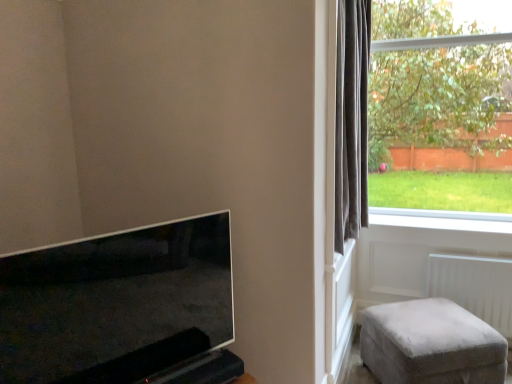
This screenshot has width=512, height=384. I want to click on transparent glass window at right, so coord(438,91).

The width and height of the screenshot is (512, 384). What do you see at coordinates (431, 344) in the screenshot?
I see `velvet grey ottoman at lower right` at bounding box center [431, 344].

What is the approximate width of velvet grey ottoman at lower right?

velvet grey ottoman at lower right is 24.10 inches wide.

Locate an element on the screen. matte black tv at lower left is located at coordinates (116, 304).

The width and height of the screenshot is (512, 384). What do you see at coordinates (116, 304) in the screenshot? I see `matte black tv at lower left` at bounding box center [116, 304].

The height and width of the screenshot is (384, 512). Identify the location of dark grey velvet curtain at right. (351, 119).

Find the location of a particular element. This screenshot has width=512, height=384. transparent glass window at right is located at coordinates tap(438, 91).

Based on the photo, looking at their sizes, would you say dark grey velvet curtain at right is wider or thinner than white smooth window sill at lower right?

In the image, dark grey velvet curtain at right appears to be more narrow than white smooth window sill at lower right.

Is dark grey velvet curtain at right bigger or smaller than white smooth window sill at lower right?

In the image, dark grey velvet curtain at right appears to be larger than white smooth window sill at lower right.

From their relative heights in the image, would you say dark grey velvet curtain at right is taller or shorter than white smooth window sill at lower right?

Clearly, dark grey velvet curtain at right is taller compared to white smooth window sill at lower right.

Is velvet grey ottoman at lower right turned away from dark grey velvet curtain at right?

velvet grey ottoman at lower right is not turned away from dark grey velvet curtain at right.

Is velvet grey ottoman at lower right taller or shorter than dark grey velvet curtain at right?

In the image, velvet grey ottoman at lower right appears to be shorter than dark grey velvet curtain at right.

How different are the orientations of velvet grey ottoman at lower right and dark grey velvet curtain at right in degrees?

The angular difference between velvet grey ottoman at lower right and dark grey velvet curtain at right is 55.4 degrees.

From a real-world perspective, is velvet grey ottoman at lower right positioned under dark grey velvet curtain at right based on gravity?

Correct, in the physical world, velvet grey ottoman at lower right is lower than dark grey velvet curtain at right.

Which is closer to the camera, (439,356) or (182,270)?

Point (182,270)

From a real-world perspective, is velvet grey ottoman at lower right positioned above or below matte black tv at lower left?

velvet grey ottoman at lower right is below matte black tv at lower left.

From the picture: Can you tell me how much velvet grey ottoman at lower right and matte black tv at lower left differ in facing direction?

There is a 27-degree angle between the facing directions of velvet grey ottoman at lower right and matte black tv at lower left.

From the image's perspective, is matte black tv at lower left on top of transparent glass window at right?

No, from the image's perspective, matte black tv at lower left is not above transparent glass window at right.

How different are the orientations of matte black tv at lower left and transparent glass window at right in degrees?

60.8 degrees separate the facing orientations of matte black tv at lower left and transparent glass window at right.

Is matte black tv at lower left at the right side of transparent glass window at right?

In fact, matte black tv at lower left is to the left of transparent glass window at right.

Could you tell me if matte black tv at lower left is turned towards transparent glass window at right?

No, matte black tv at lower left is not aimed at transparent glass window at right.

Is white plastic radiator at lower right taller or shorter than velvet grey ottoman at lower right?

Considering their sizes, white plastic radiator at lower right has more height than velvet grey ottoman at lower right.

Is white plastic radiator at lower right not within velvet grey ottoman at lower right?

Yes, white plastic radiator at lower right is outside of velvet grey ottoman at lower right.

Measure the distance from white plastic radiator at lower right to velvet grey ottoman at lower right.

white plastic radiator at lower right and velvet grey ottoman at lower right are 45.73 centimeters apart from each other.

Which of these two, white smooth window sill at lower right or velvet grey ottoman at lower right, is bigger?

With larger size is velvet grey ottoman at lower right.

Does white smooth window sill at lower right turn towards velvet grey ottoman at lower right?

No, white smooth window sill at lower right is not aimed at velvet grey ottoman at lower right.

Looking at their sizes, would you say white smooth window sill at lower right is wider or thinner than velvet grey ottoman at lower right?

In the image, white smooth window sill at lower right appears to be more narrow than velvet grey ottoman at lower right.

Which is in front, point (370, 209) or point (455, 376)?

The point (455, 376) is closer.

Based on the photo, are transparent glass window at right and matte black tv at lower left making contact?

transparent glass window at right and matte black tv at lower left are not in contact.

Is transparent glass window at right to the right of matte black tv at lower left from the viewer's perspective?

Correct, you'll find transparent glass window at right to the right of matte black tv at lower left.

From the image's perspective, which one is positioned higher, transparent glass window at right or matte black tv at lower left?

transparent glass window at right appears higher in the image.

Locate an element on the screen. window sill below the dark grey velvet curtain at right (from a real-world perspective) is located at coordinates (442, 219).

You are a GUI agent. You are given a task and a screenshot of the screen. Output one action in this format:
    pyautogui.click(x=<x>, y=<y>)
    Task: Click on the furniture lying on the right of dark grey velvet curtain at right
    
    Given the screenshot: What is the action you would take?
    pyautogui.click(x=431, y=344)

Considering their positions, is transparent glass window at right positioned further to velvet grey ottoman at lower right than matte black tv at lower left?

The object further to velvet grey ottoman at lower right is transparent glass window at right.

From the image, which object appears to be nearer to dark grey velvet curtain at right, white smooth window sill at lower right or velvet grey ottoman at lower right?

white smooth window sill at lower right is closer to dark grey velvet curtain at right.

Estimate the real-world distances between objects in this image. Which object is further from white plastic radiator at lower right, matte black tv at lower left or white smooth window sill at lower right?

Based on the image, matte black tv at lower left appears to be further to white plastic radiator at lower right.

Considering their positions, is white plastic radiator at lower right positioned further to dark grey velvet curtain at right than velvet grey ottoman at lower right?

white plastic radiator at lower right.

From the image, which object appears to be nearer to matte black tv at lower left, transparent glass window at right or white plastic radiator at lower right?

Based on the image, white plastic radiator at lower right appears to be nearer to matte black tv at lower left.

Looking at the image, which one is located closer to matte black tv at lower left, dark grey velvet curtain at right or transparent glass window at right?

Based on the image, dark grey velvet curtain at right appears to be nearer to matte black tv at lower left.

Considering their positions, is matte black tv at lower left positioned further to dark grey velvet curtain at right than velvet grey ottoman at lower right?

matte black tv at lower left lies further to dark grey velvet curtain at right than the other object.

From the image, which object appears to be farther from white plastic radiator at lower right, matte black tv at lower left or velvet grey ottoman at lower right?

matte black tv at lower left is further to white plastic radiator at lower right.

Image resolution: width=512 pixels, height=384 pixels. Find the location of `furniture between matte black tv at lower left and white smooth window sill at lower right in the horizontal direction`. furniture between matte black tv at lower left and white smooth window sill at lower right in the horizontal direction is located at coordinates (431, 344).

You are a GUI agent. You are given a task and a screenshot of the screen. Output one action in this format:
    pyautogui.click(x=<x>, y=<y>)
    Task: Click on the curtain between transparent glass window at right and white smooth window sill at lower right vertically
    
    Given the screenshot: What is the action you would take?
    pyautogui.click(x=351, y=119)

The width and height of the screenshot is (512, 384). Identify the location of window sill that lies between dark grey velvet curtain at right and white plastic radiator at lower right from top to bottom. (442, 219).

Identify the location of furniture located between matte black tv at lower left and transparent glass window at right in the left-right direction. (431, 344).